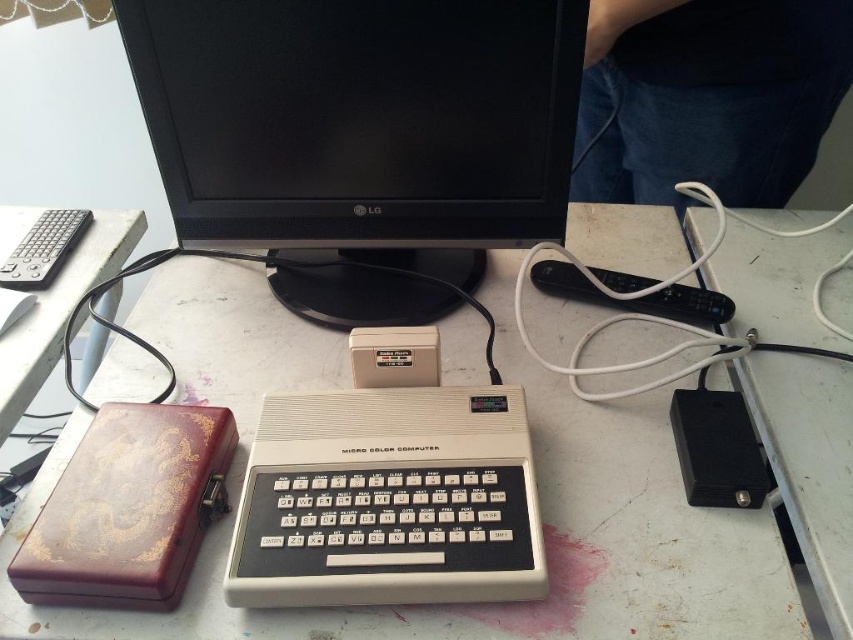
You are taking a photo of the vintage microcomputer setup. The camera you are using has a focal length of 50mm and an aperture of f2.8. To ensure the point at coordinates point (354, 202) is in focus, what is the minimum distance you need to be from the setup?

The point at coordinates point (354, 202) is 32.94 inches from the camera. Therefore, you need to be at least 32.94 inches away from the setup to ensure it is in focus.

You are setting up a desk and need to place the matte black monitor at center and the wooden at left. According to the scene, which object should be placed on the left side of the desk?

The wooden at left should be placed on the left side of the desk because the matte black monitor at center is to the right of it.